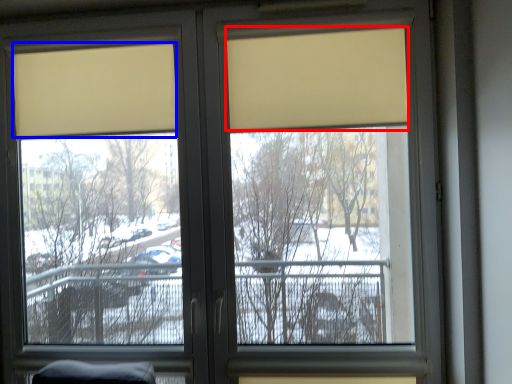
Question: Which of the following is the closest to the observer, curtain (highlighted by a red box) or curtain (highlighted by a blue box)?

Choices:
 (A) curtain
 (B) curtain

Answer: (A)